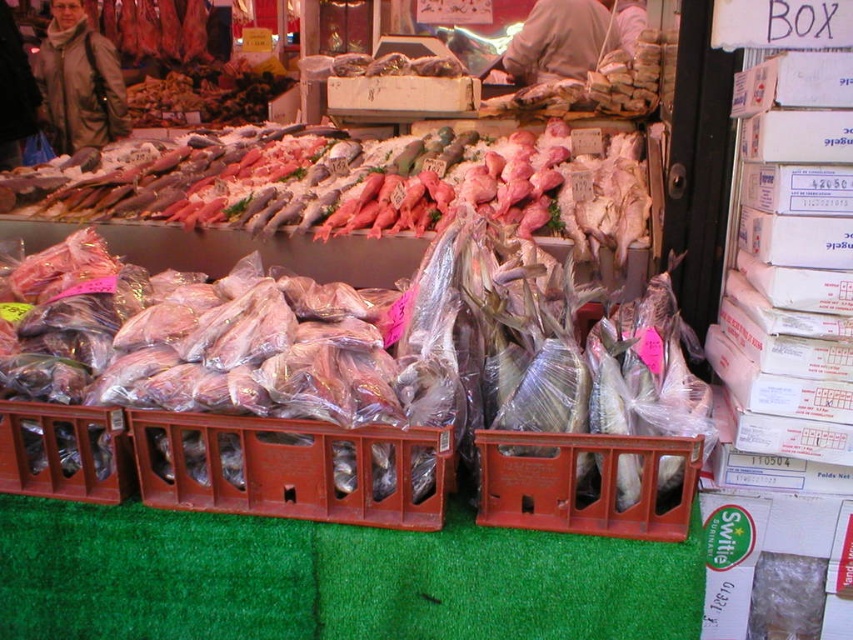
Consider the image. You are a customer at the fish market and want to pick up the orange plastic crate at center. However, there is a brown leather jacket at upper center in the way. Can you reach the crate without moving the jacket?

The orange plastic crate at center has a lesser height compared to brown leather jacket at upper center, so you can reach the crate without moving the jacket since it is shorter and not blocking the path.

You are at the fish market and need to locate the brown plastic crate at center. According to the coordinates provided, where exactly is it positioned?

The brown plastic crate at center is located at point (289, 468).